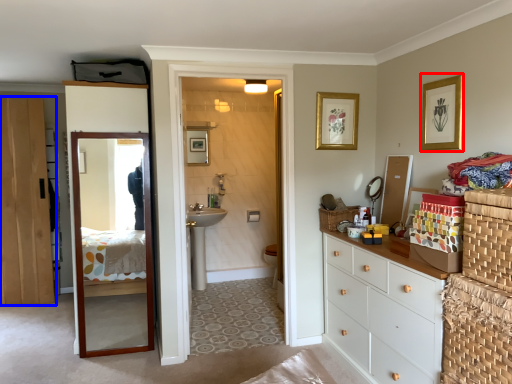
Question: Which object appears closest to the camera in this image, picture frame (highlighted by a red box) or door (highlighted by a blue box)?

Choices:
 (A) picture frame
 (B) door

Answer: (A)